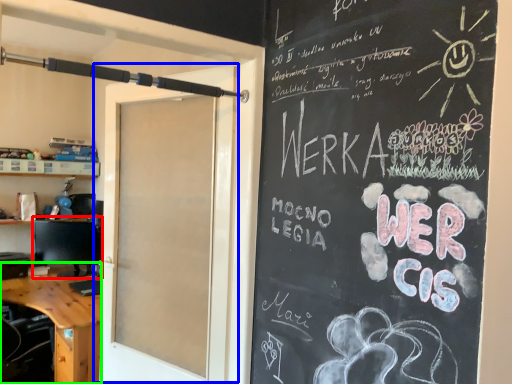
Question: Estimate the real-world distances between objects in this image. Which object is farther from computer monitor (highlighted by a red box), door (highlighted by a blue box) or desk (highlighted by a green box)?

Choices:
 (A) door
 (B) desk

Answer: (A)